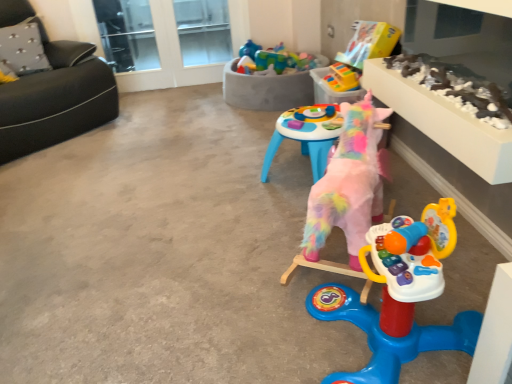
The height and width of the screenshot is (384, 512). What are the coordinates of `translucent plastic toys at upper center, acting as the fifth toy starting from the front` in the screenshot? It's located at (269, 80).

I want to click on transparent glass door at upper center, so click(x=127, y=34).

Where is `multicolored plastic toy at upper center, which is the third toy from back to front`? Image resolution: width=512 pixels, height=384 pixels. multicolored plastic toy at upper center, which is the third toy from back to front is located at coordinates (368, 44).

Where is `black leather couch at left`? This screenshot has height=384, width=512. black leather couch at left is located at coordinates [56, 99].

Measure the distance between rubberized plastic toy at upper center, arranged as the 4th toy when viewed from the front, and camera.

The depth of rubberized plastic toy at upper center, arranged as the 4th toy when viewed from the front, is 7.71 feet.

Where is `white textured table at upper right`? white textured table at upper right is located at coordinates (444, 123).

Locate an element on the screen. The image size is (512, 384). transparent glass window at upper center is located at coordinates (203, 31).

What's the angular difference between transparent glass window at upper center and translucent plastic toys at upper center, acting as the fifth toy starting from the front,'s facing directions?

The angle between the facing direction of transparent glass window at upper center and the facing direction of translucent plastic toys at upper center, acting as the fifth toy starting from the front, is 90.2 degrees.

In the scene shown: Could translucent plastic toys at upper center, acting as the fifth toy starting from the front, be considered to be inside transparent glass window at upper center?

No, translucent plastic toys at upper center, acting as the fifth toy starting from the front, is located outside of transparent glass window at upper center.

Between transparent glass window at upper center and translucent plastic toys at upper center, which is the 1th toy in back-to-front order, which one has smaller width?

transparent glass window at upper center is thinner.

Looking at this image, is transparent glass window at upper center touching translucent plastic toys at upper center, which is the 1th toy in back-to-front order?

There is a gap between transparent glass window at upper center and translucent plastic toys at upper center, which is the 1th toy in back-to-front order.

Between white textured table at upper right and plush pink unicorn at center, the 1th toy positioned from the front, which one appears on the left side from the viewer's perspective?

From the viewer's perspective, plush pink unicorn at center, the 1th toy positioned from the front, appears more on the left side.

Is white textured table at upper right not close to plush pink unicorn at center, the 1th toy positioned from the front?

No, white textured table at upper right is not far away from plush pink unicorn at center, the 1th toy positioned from the front.

Is white textured table at upper right positioned behind plush pink unicorn at center, arranged as the fifth toy when viewed from the back?

Yes, white textured table at upper right is further from the viewer.

What's the angular difference between white textured table at upper right and multicolored plastic toy at upper center, which is the third toy from back to front,'s facing directions?

The facing directions of white textured table at upper right and multicolored plastic toy at upper center, which is the third toy from back to front, are 0.26 degrees apart.

Is white textured table at upper right spatially inside multicolored plastic toy at upper center, acting as the 3th toy starting from the front, or outside of it?

white textured table at upper right exists outside the volume of multicolored plastic toy at upper center, acting as the 3th toy starting from the front.

Which is more distant, (429, 115) or (354, 84)?

The point (354, 84) is farther from the camera.

Image resolution: width=512 pixels, height=384 pixels. In order to click on table that is below the multicolored plastic toy at upper center, acting as the 3th toy starting from the front (from the image's perspective) in this screenshot , I will do `click(444, 123)`.

Is transparent glass window at upper center taller or shorter than plush pink unicorn at center, arranged as the fifth toy when viewed from the back?

Clearly, transparent glass window at upper center is taller compared to plush pink unicorn at center, arranged as the fifth toy when viewed from the back.

Is plush pink unicorn at center, the 1th toy positioned from the front, located within transparent glass window at upper center?

No, transparent glass window at upper center does not contain plush pink unicorn at center, the 1th toy positioned from the front.

Can you tell me how much transparent glass window at upper center and plush pink unicorn at center, arranged as the fifth toy when viewed from the back, differ in facing direction?

The angular difference between transparent glass window at upper center and plush pink unicorn at center, arranged as the fifth toy when viewed from the back, is 99.7 degrees.

Which is farther, (x=199, y=64) or (x=364, y=251)?

The point (x=199, y=64) is farther from the camera.

Image resolution: width=512 pixels, height=384 pixels. I want to click on window screen above the gray fabric pillow at upper left (from the image's perspective), so click(x=203, y=31).

Is point (224, 25) positioned before point (1, 50)?

No, it is behind (1, 50).

Who is smaller, transparent glass window at upper center or gray fabric pillow at upper left?

transparent glass window at upper center is smaller.

Is transparent glass window at upper center turned away from transparent glass screen door at upper center?

Yes, transparent glass window at upper center is positioned with its back facing transparent glass screen door at upper center.

From the image's perspective, is transparent glass window at upper center below transparent glass screen door at upper center?

Actually, transparent glass window at upper center appears above transparent glass screen door at upper center in the image.

Which is closer, (190, 38) or (114, 60)?

Clearly, point (190, 38) is more distant from the camera than point (114, 60).

Considering the sizes of objects transparent glass window at upper center and transparent glass screen door at upper center in the image provided, who is bigger, transparent glass window at upper center or transparent glass screen door at upper center?

With larger size is transparent glass screen door at upper center.

Is rubberized plastic toy at upper center, arranged as the 4th toy when viewed from the front, positioned before transparent glass door at upper center?

Yes, it is.

Which of these two, rubberized plastic toy at upper center, arranged as the 4th toy when viewed from the front, or transparent glass door at upper center, is thinner?

Thinner between the two is transparent glass door at upper center.

Can you confirm if rubberized plastic toy at upper center, arranged as the 4th toy when viewed from the front, is smaller than transparent glass door at upper center?

Yes.

Are rubberized plastic toy at upper center, which is the 2th toy in back-to-front order, and transparent glass door at upper center far apart?

Yes, rubberized plastic toy at upper center, which is the 2th toy in back-to-front order, and transparent glass door at upper center are quite far apart.

Where is `window screen above the translucent plastic toys at upper center, acting as the fifth toy starting from the front (from the image's perspective)`? window screen above the translucent plastic toys at upper center, acting as the fifth toy starting from the front (from the image's perspective) is located at coordinates (203, 31).

You are a GUI agent. You are given a task and a screenshot of the screen. Output one action in this format:
    pyautogui.click(x=<x>, y=<y>)
    Task: Click on the table lying behind the plush pink unicorn at center, the 1th toy positioned from the front
    This screenshot has height=384, width=512.
    Given the screenshot: What is the action you would take?
    pyautogui.click(x=444, y=123)

Which object lies further to the anchor point transparent glass door at upper center, transparent glass screen door at upper center or gray fabric pillow at upper left?

gray fabric pillow at upper left.

When comparing their distances from transparent glass window at upper center, does white textured table at upper right or translucent plastic toys at upper center, which is the 1th toy in back-to-front order, seem closer?

translucent plastic toys at upper center, which is the 1th toy in back-to-front order, is positioned closer to the anchor transparent glass window at upper center.

Which object lies further to the anchor point rubberized plastic toy at upper center, arranged as the 4th toy when viewed from the front, fluffy pink unicorn at center, the 2th toy in the front-to-back sequence, or transparent glass door at upper center?

Based on the image, transparent glass door at upper center appears to be further to rubberized plastic toy at upper center, arranged as the 4th toy when viewed from the front.

Based on their spatial positions, is transparent glass window at upper center or transparent glass screen door at upper center further from fluffy pink unicorn at center, the 2th toy in the front-to-back sequence?

transparent glass window at upper center is positioned further to the anchor fluffy pink unicorn at center, the 2th toy in the front-to-back sequence.

From the image, which object appears to be farther from multicolored plastic toy at upper center, which is the third toy from back to front, fluffy pink unicorn at center, which is counted as the 4th toy, starting from the back, or gray fabric pillow at upper left?

gray fabric pillow at upper left lies further to multicolored plastic toy at upper center, which is the third toy from back to front, than the other object.

Which object lies nearer to the anchor point rubberized plastic toy at upper center, which is the 2th toy in back-to-front order, multicolored plastic toy at upper center, acting as the 3th toy starting from the front, or transparent glass screen door at upper center?

multicolored plastic toy at upper center, acting as the 3th toy starting from the front.

Considering their positions, is multicolored plastic toy at upper center, acting as the 3th toy starting from the front, positioned closer to black leather couch at left than plush pink unicorn at center, arranged as the fifth toy when viewed from the back?

multicolored plastic toy at upper center, acting as the 3th toy starting from the front.

In the scene shown: Based on their spatial positions, is transparent glass window at upper center or black leather couch at left further from white textured table at upper right?

Among the two, transparent glass window at upper center is located further to white textured table at upper right.

Locate an element on the screen. The height and width of the screenshot is (384, 512). screen door located between gray fabric pillow at upper left and transparent glass window at upper center in the left-right direction is located at coordinates (164, 41).

The image size is (512, 384). In order to click on screen door between transparent glass door at upper center and translucent plastic toys at upper center, acting as the fifth toy starting from the front, from left to right in this screenshot , I will do click(x=164, y=41).

I want to click on screen door located between plush pink unicorn at center, arranged as the fifth toy when viewed from the back, and transparent glass window at upper center in the depth direction, so click(x=164, y=41).

The width and height of the screenshot is (512, 384). I want to click on screen door between gray fabric pillow at upper left and translucent plastic toys at upper center, which is the 1th toy in back-to-front order, from left to right, so click(x=164, y=41).